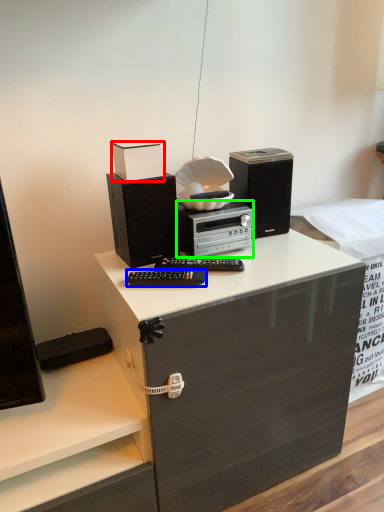
Question: Which is farther away from box (highlighted by a red box)? equipment (highlighted by a blue box) or home appliance (highlighted by a green box)?

Choices:
 (A) equipment
 (B) home appliance

Answer: (A)